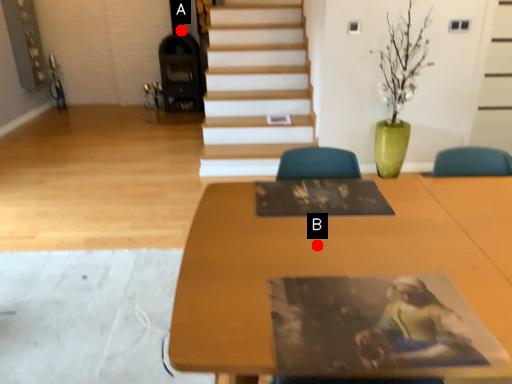
Question: Two points are circled on the image, labeled by A and B beside each circle. Which point is closer to the camera?

Choices:
 (A) A is closer
 (B) B is closer

Answer: (B)